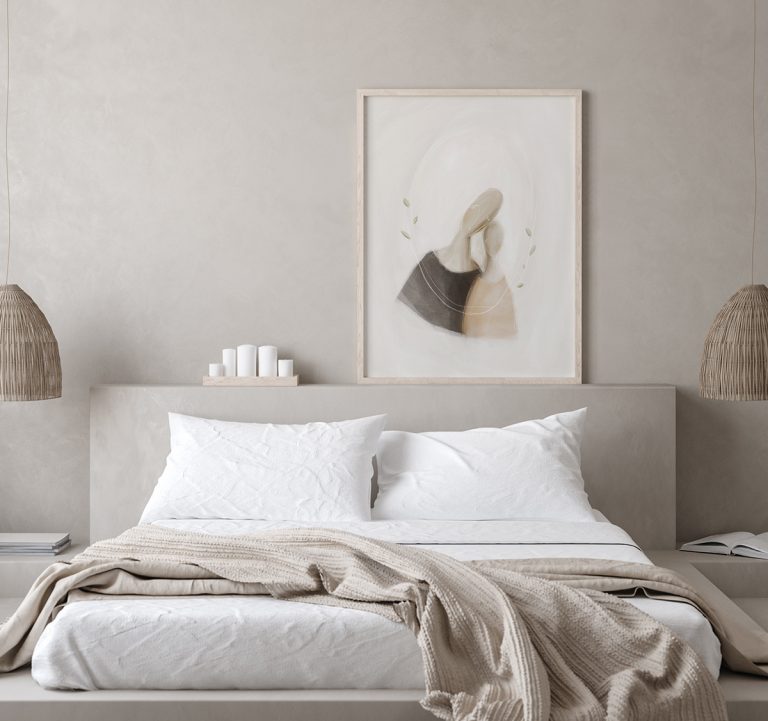
Locate an element on the screen. lamp shades is located at coordinates (34, 345), (735, 350).